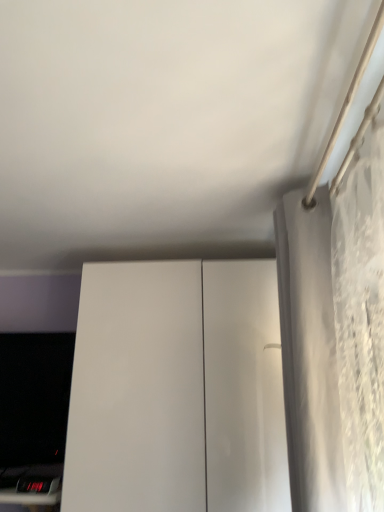
Question: Does black glossy computer monitor at lower left turn towards white glossy cabinet at center?

Choices:
 (A) no
 (B) yes

Answer: (A)

Question: Does black glossy computer monitor at lower left have a larger size compared to white glossy cabinet at center?

Choices:
 (A) no
 (B) yes

Answer: (A)

Question: Are black glossy computer monitor at lower left and white glossy cabinet at center beside each other?

Choices:
 (A) yes
 (B) no

Answer: (B)

Question: Can you confirm if black glossy computer monitor at lower left is smaller than white glossy cabinet at center?

Choices:
 (A) no
 (B) yes

Answer: (B)

Question: Would you say black glossy computer monitor at lower left is outside white glossy cabinet at center?

Choices:
 (A) yes
 (B) no

Answer: (A)

Question: Do you think black glossy computer monitor at lower left is within white textured curtain at right, or outside of it?

Choices:
 (A) outside
 (B) inside

Answer: (A)

Question: From a real-world perspective, is black glossy computer monitor at lower left above or below white textured curtain at right?

Choices:
 (A) below
 (B) above

Answer: (A)

Question: Considering the positions of point (29, 420) and point (291, 375), is point (29, 420) closer or farther from the camera than point (291, 375)?

Choices:
 (A) farther
 (B) closer

Answer: (A)

Question: From their relative heights in the image, would you say black glossy computer monitor at lower left is taller or shorter than white textured curtain at right?

Choices:
 (A) tall
 (B) short

Answer: (B)

Question: From a real-world perspective, relative to white glossy cabinet at center, is white textured curtain at right vertically above or below?

Choices:
 (A) below
 (B) above

Answer: (B)

Question: Is white textured curtain at right to the left or to the right of white glossy cabinet at center in the image?

Choices:
 (A) left
 (B) right

Answer: (B)

Question: Is point (301, 354) closer or farther from the camera than point (155, 457)?

Choices:
 (A) closer
 (B) farther

Answer: (A)

Question: Looking at their shapes, would you say white textured curtain at right is wider or thinner than white glossy cabinet at center?

Choices:
 (A) thin
 (B) wide

Answer: (A)

Question: Based on their positions, is white textured curtain at right located to the left or right of black glossy computer monitor at lower left?

Choices:
 (A) left
 (B) right

Answer: (B)

Question: Considering their positions, is white textured curtain at right located in front of or behind black glossy computer monitor at lower left?

Choices:
 (A) behind
 (B) front

Answer: (B)